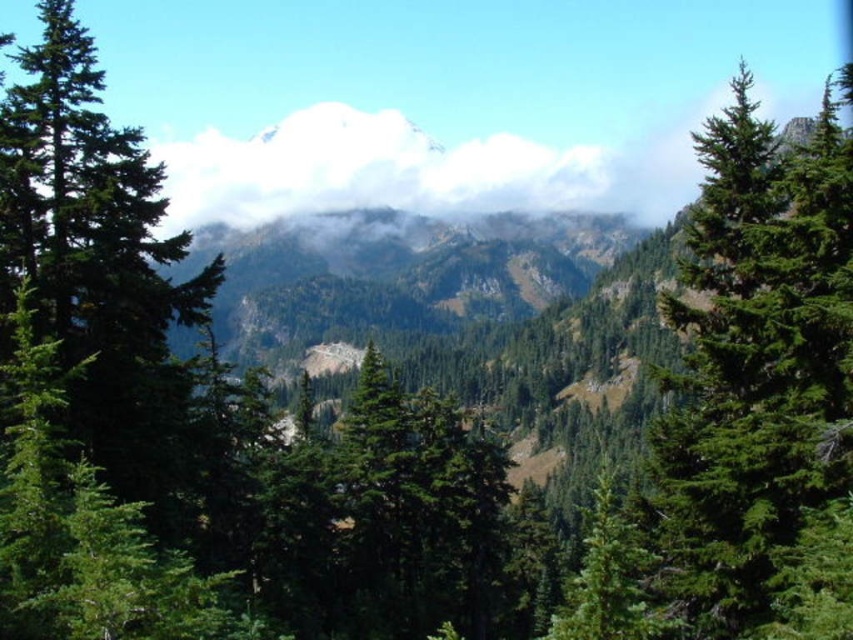
You are standing at the base of the mountain looking towards the valley. You see two points marked in the image. Which point is closer to you, point (712, 195) or point (352, 134)?

Point (712, 195) is in front of point (352, 134), so it is closer to you.